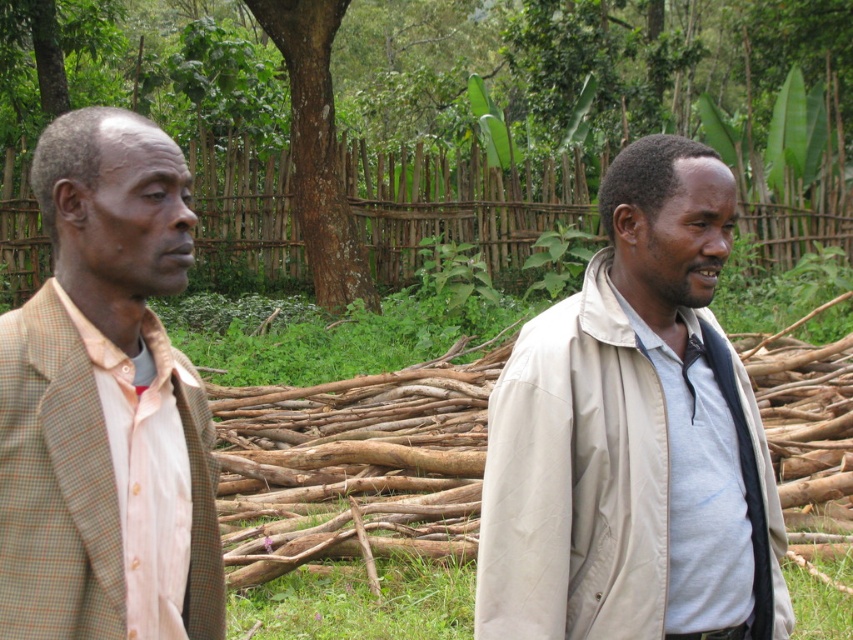
Consider the image. You are a photographer trying to capture a closeup of the wooden fence. You notice two points marked on your viewfinder at coordinates point (547, 480) and point (172, 433). Which point should you focus on to ensure the wooden fence is in sharp focus?

You should focus on point (547, 480) because it is closer to the camera than point (172, 433), which is further away. Since the wooden fence is in the middle ground, the point nearer to the camera will ensure better focus on it.

You are a photographer trying to capture a closeup of the beige fabric jacket at right. Based on its position, which part of the image should you focus on to ensure the jacket is in sharp focus?

The beige fabric jacket at right is located at point (633, 435), so you should focus on that coordinate to ensure it is in sharp focus.

You are a photographer trying to capture both the beige fabric jacket at right and the light brown checkered blazer at left in a single shot. Which jacket will appear closer to the camera in the photo?

The beige fabric jacket at right will appear closer to the camera because it is positioned further to the viewer compared to the light brown checkered blazer at left.